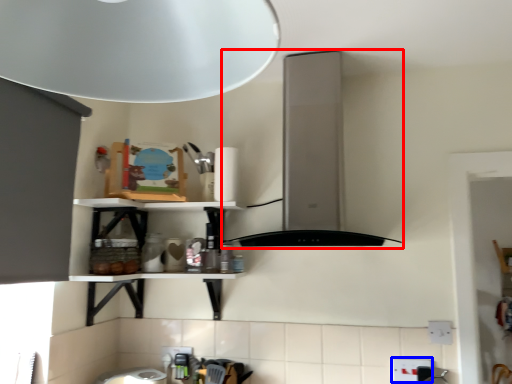
Question: Among these objects, which one is farthest to the camera, vent (highlighted by a red box) or electric outlet (highlighted by a blue box)?

Choices:
 (A) vent
 (B) electric outlet

Answer: (B)